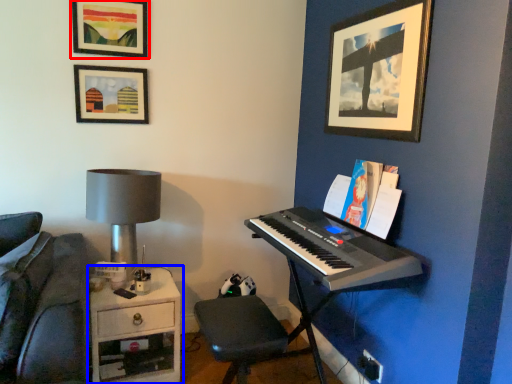
Question: Which point is closer to the camera, picture frame (highlighted by a red box) or table (highlighted by a blue box)?

Choices:
 (A) picture frame
 (B) table

Answer: (B)